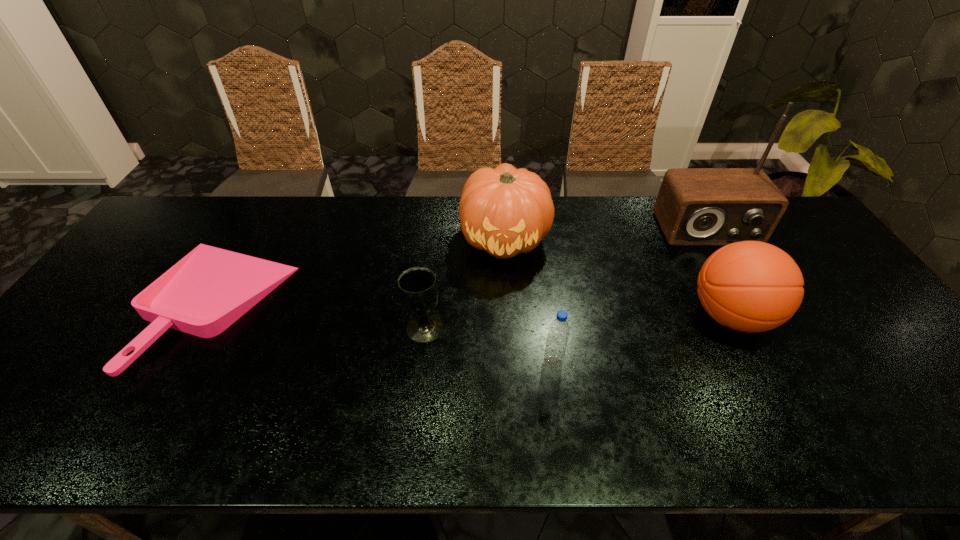
The image size is (960, 540). In order to click on vacant area that lies between the chalice and the basketball in this screenshot , I will do `click(577, 322)`.

Where is `free area in between the fifth object from right to left and the water bottle`? free area in between the fifth object from right to left and the water bottle is located at coordinates (489, 345).

Locate an element on the screen. The image size is (960, 540). vacant area that lies between the pumpkin and the dustpan is located at coordinates (360, 271).

Locate which object is the fourth closest to the basketball. Please provide its 2D coordinates. Your answer should be formatted as a tuple, i.e. [(x, y)], where the tuple contains the x and y coordinates of a point satisfying the conditions above.

[(418, 290)]

At what (x,y) coordinates should I click in order to perform the action: click on the fifth closest object relative to the water bottle. Please return your answer as a coordinate pair (x, y). The height and width of the screenshot is (540, 960). Looking at the image, I should click on (210, 288).

Find the location of a particular element. Image resolution: width=960 pixels, height=540 pixels. vacant region that satisfies the following two spatial constraints: 1. on the handle side of the shortest object; 2. on the back side of the fifth object from right to left is located at coordinates (203, 327).

Where is `free spot that satisfies the following two spatial constraints: 1. on the handle side of the chalice; 2. on the right side of the dustpan`? The width and height of the screenshot is (960, 540). free spot that satisfies the following two spatial constraints: 1. on the handle side of the chalice; 2. on the right side of the dustpan is located at coordinates (203, 327).

You are a GUI agent. You are given a task and a screenshot of the screen. Output one action in this format:
    pyautogui.click(x=<x>, y=<y>)
    Task: Click on the vacant space that satisfies the following two spatial constraints: 1. on the front-facing side of the radio receiver; 2. on the handle side of the shortest object
    This screenshot has width=960, height=540.
    Given the screenshot: What is the action you would take?
    pyautogui.click(x=749, y=304)

The width and height of the screenshot is (960, 540). In order to click on free space that satisfies the following two spatial constraints: 1. on the handle side of the shortest object; 2. on the left side of the second object from left to right in this screenshot , I will do `click(203, 327)`.

Where is `free spot that satisfies the following two spatial constraints: 1. on the carved face of the pumpkin; 2. on the handle side of the shortest object`? The width and height of the screenshot is (960, 540). free spot that satisfies the following two spatial constraints: 1. on the carved face of the pumpkin; 2. on the handle side of the shortest object is located at coordinates (509, 304).